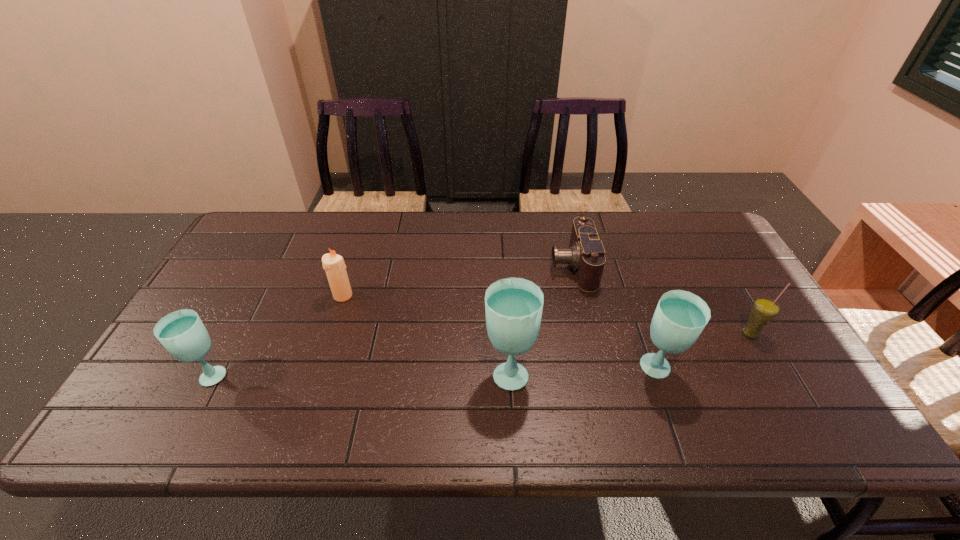
Locate an element on the screen. empty space between the fourth object from right to left and the candle is located at coordinates (426, 334).

The image size is (960, 540). Identify the location of blank region between the second object from right to left and the leftmost glass. pyautogui.click(x=434, y=372).

Locate an element on the screen. The image size is (960, 540). vacant space that is in between the candle and the third object from left to right is located at coordinates (426, 334).

Locate an element on the screen. This screenshot has width=960, height=540. vacant area between the second object from right to left and the shortest object is located at coordinates (614, 318).

Find the location of `free spot between the leftmost object and the second tallest object`. free spot between the leftmost object and the second tallest object is located at coordinates (434, 372).

Find the location of a particular element. Image resolution: width=960 pixels, height=540 pixels. free space between the fifth object from right to left and the second glass from left to right is located at coordinates (426, 334).

This screenshot has height=540, width=960. I want to click on free space between the fifth object from left to right and the shortest glass, so click(434, 372).

In order to click on object identified as the second closest to the fifth shortest object in this screenshot , I will do `click(586, 254)`.

Where is `object that ranks as the third closest to the rightmost glass`? The image size is (960, 540). object that ranks as the third closest to the rightmost glass is located at coordinates (513, 306).

Point out which glass is positioned as the nearest to the fourth object from left to right. Please provide its 2D coordinates. Your answer should be formatted as a tuple, i.e. [(x, y)], where the tuple contains the x and y coordinates of a point satisfying the conditions above.

[(680, 317)]